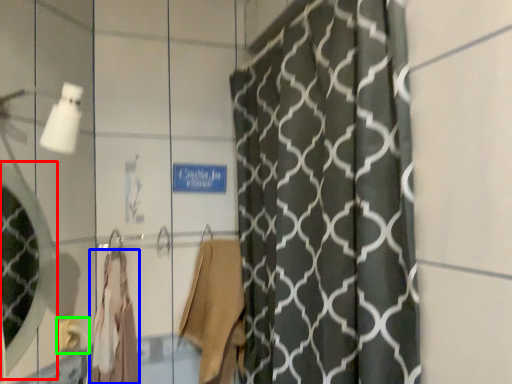
Question: Which object is positioned farthest from mirror (highlighted by a red box)? Select from robe (highlighted by a blue box) and towel bar (highlighted by a green box).

Choices:
 (A) robe
 (B) towel bar

Answer: (B)